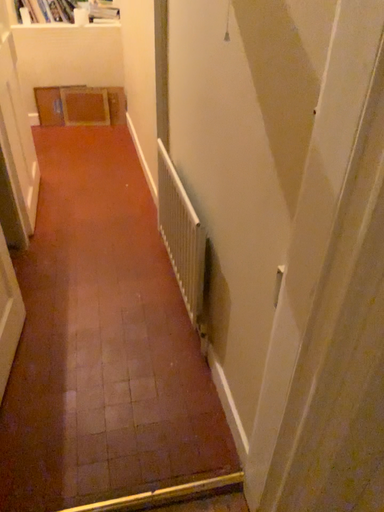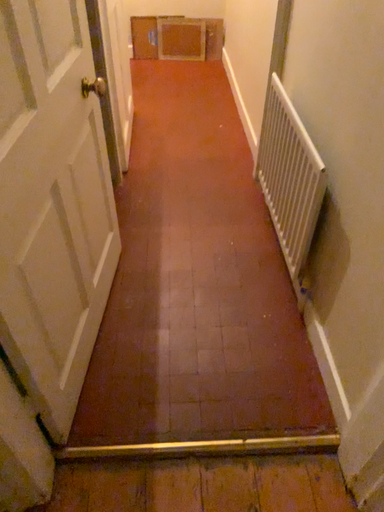
Question: How did the camera likely rotate when shooting the video?

Choices:
 (A) rotated downward
 (B) rotated upward

Answer: (A)